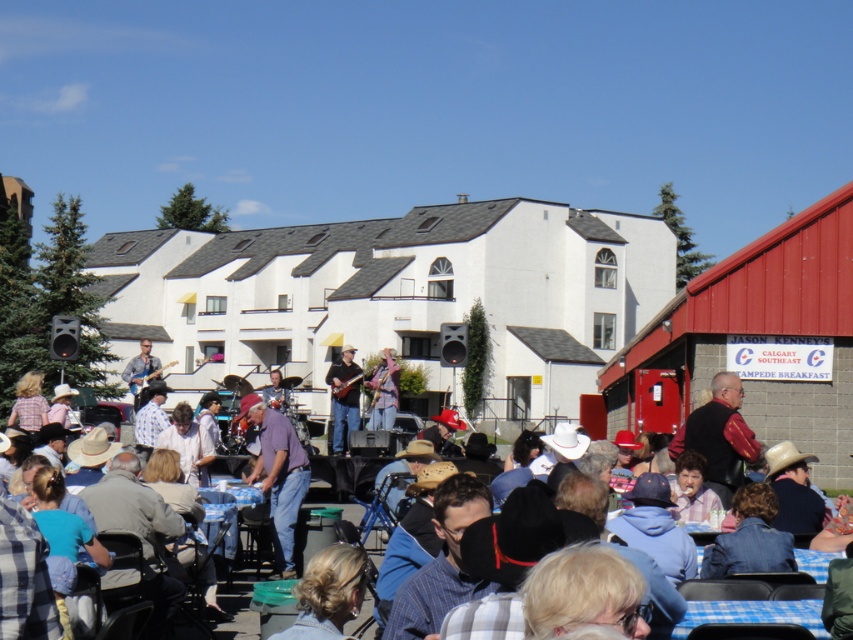
Consider the image. You are at the community gathering and want to borrow an instrument from the person sitting next to you. The person is holding the matte brown guitar at center. Where is the denim jacket at center located relative to the guitar?

The denim jacket at center is to the right of the matte brown guitar at center.